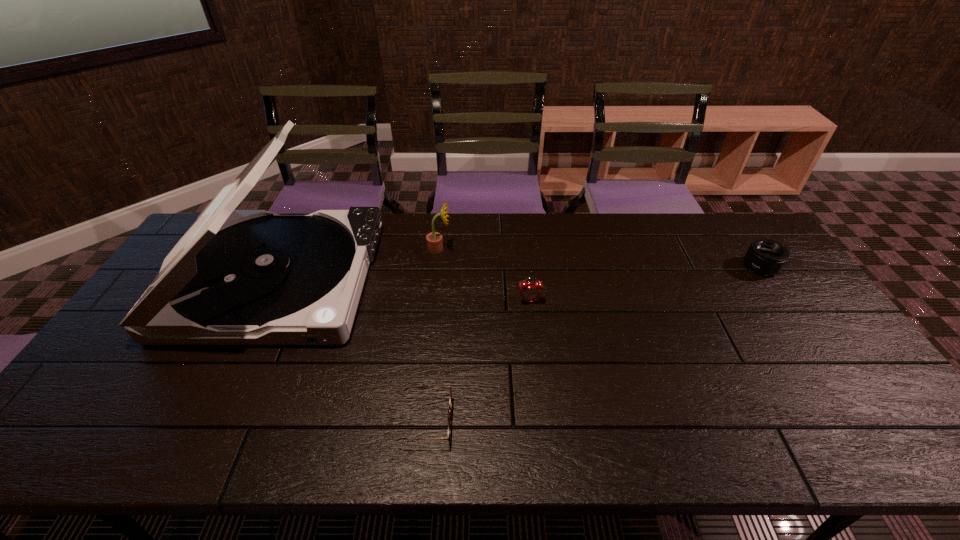
Where is `object at the left edge`? object at the left edge is located at coordinates (236, 277).

Where is `object that is at the right edge`? The width and height of the screenshot is (960, 540). object that is at the right edge is located at coordinates (764, 256).

Where is `object that is at the far left corner`? This screenshot has height=540, width=960. object that is at the far left corner is located at coordinates (236, 277).

What are the coordinates of `object at the far right corner` in the screenshot? It's located at (764, 256).

In the image, there is a desktop. Where is `vacant region at the far edge`? vacant region at the far edge is located at coordinates (387, 226).

You are a GUI agent. You are given a task and a screenshot of the screen. Output one action in this format:
    pyautogui.click(x=<x>, y=<y>)
    Task: Click on the free spot at the near edge of the desktop
    The height and width of the screenshot is (540, 960).
    Given the screenshot: What is the action you would take?
    (152, 426)

You are a GUI agent. You are given a task and a screenshot of the screen. Output one action in this format:
    pyautogui.click(x=<x>, y=<y>)
    Task: Click on the vacant region at the left edge
    
    Given the screenshot: What is the action you would take?
    pyautogui.click(x=108, y=374)

In the image, there is a desktop. At what (x,y) coordinates should I click in order to perform the action: click on free space at the far right corner. Please return your answer as a coordinate pair (x, y). Image resolution: width=960 pixels, height=540 pixels. Looking at the image, I should click on (704, 214).

At what (x,y) coordinates should I click in order to perform the action: click on free space between the tallest object and the spectacles. Please return your answer as a coordinate pair (x, y). Looking at the image, I should click on (352, 350).

I want to click on unoccupied position between the sunflower and the spectacles, so pyautogui.click(x=433, y=335).